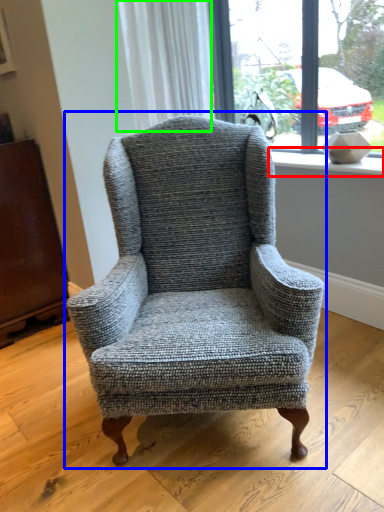
Question: Estimate the real-world distances between objects in this image. Which object is farther from window sill (highlighted by a red box), chair (highlighted by a blue box) or curtain (highlighted by a green box)?

Choices:
 (A) chair
 (B) curtain

Answer: (A)